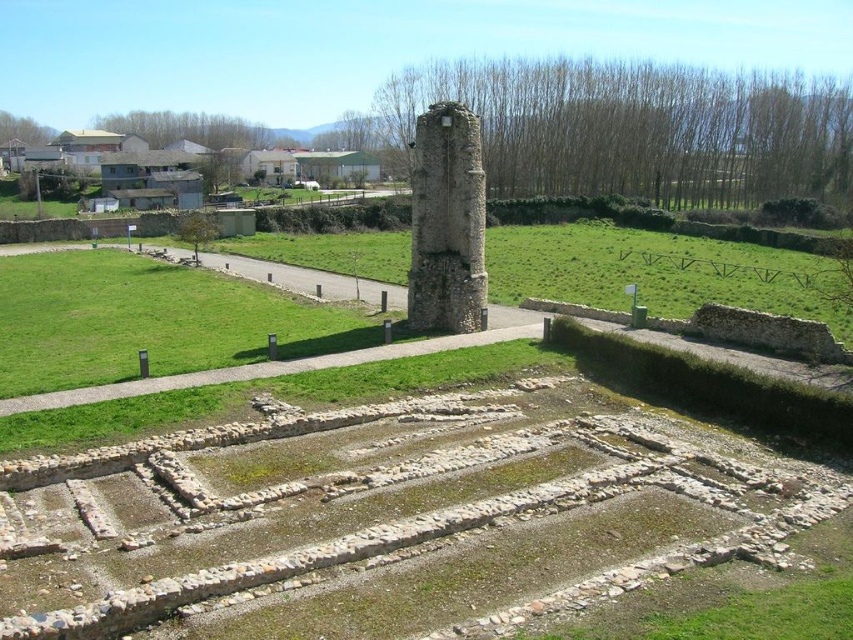
Question: Is green grass at center positioned before weathered stone pillar at center?

Choices:
 (A) yes
 (B) no

Answer: (A)

Question: Is green grass at center positioned in front of weathered stone pillar at center?

Choices:
 (A) no
 (B) yes

Answer: (B)

Question: Among these objects, which one is farthest from the camera?

Choices:
 (A) weathered stone pillar at center
 (B) green grass at center

Answer: (A)

Question: Considering the relative positions of green grass at center and weathered stone pillar at center in the image provided, where is green grass at center located with respect to weathered stone pillar at center?

Choices:
 (A) below
 (B) above

Answer: (A)